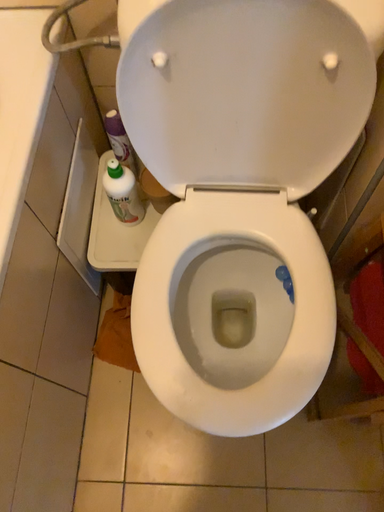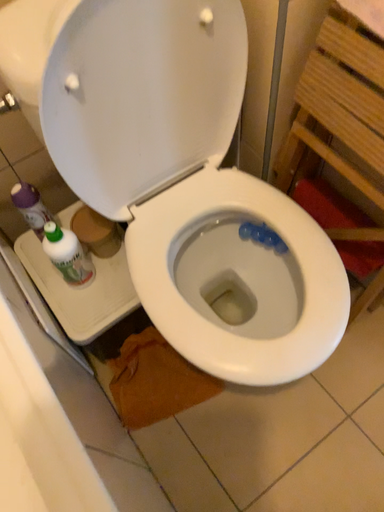
Question: How did the camera likely rotate when shooting the video?

Choices:
 (A) rotated left
 (B) rotated right

Answer: (B)